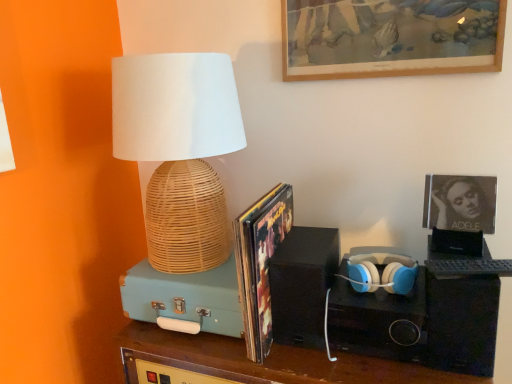
Question: Which is correct: shiny paper magazine at center is inside black matte speaker at center, which is the second speaker from left to right, or outside of it?

Choices:
 (A) inside
 (B) outside

Answer: (B)

Question: From the image's perspective, is shiny paper magazine at center located above or below black matte speaker at center, which is the second speaker from left to right?

Choices:
 (A) below
 (B) above

Answer: (B)

Question: Which object is positioned closest to the matte black album cover at upper right, which ranks as the first picture frame in bottom-to-top order?

Choices:
 (A) teal matte suitcase at left, which appears as the 3th speaker when viewed from the right
 (B) woven bamboo lamp at left
 (C) matte white and blue plastic headphones at center right
 (D) teal suitcase at center
 (E) black matte speaker at right, which appears as the first speaker when viewed from the right

Answer: (C)

Question: Considering the real-world distances, which object is closest to the black matte speaker at right, which appears as the first speaker when viewed from the right?

Choices:
 (A) matte black album cover at upper right, which ranks as the second picture frame in top-to-bottom order
 (B) shiny paper magazine at center
 (C) woven bamboo lamp at left
 (D) black matte speaker at center, marked as the second speaker in a right-to-left arrangement
 (E) teal matte suitcase at left, which appears as the 3th speaker when viewed from the right

Answer: (A)